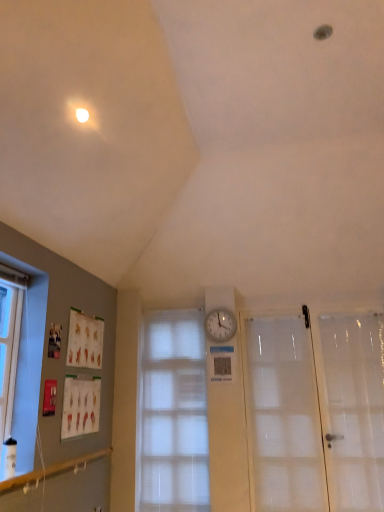
Question: From a real-world perspective, is white plastic clock at center above or below white frosted glass door at right?

Choices:
 (A) above
 (B) below

Answer: (A)

Question: Looking at their shapes, would you say white plastic clock at center is wider or thinner than white frosted glass door at right?

Choices:
 (A) thin
 (B) wide

Answer: (A)

Question: Based on their relative distances, which object is nearer to the translucent fabric window at center?

Choices:
 (A) white plastic clock at center
 (B) transparent plastic screen door at right
 (C) white frosted glass door at right

Answer: (A)

Question: Which of these objects is positioned closest to the transparent plastic screen door at right?

Choices:
 (A) white frosted glass door at right
 (B) translucent fabric window at center
 (C) white plastic clock at center

Answer: (A)